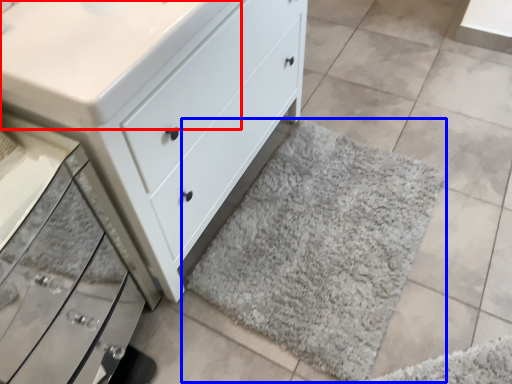
Question: Which object appears farthest to the camera in this image, counter top (highlighted by a red box) or bath mat (highlighted by a blue box)?

Choices:
 (A) counter top
 (B) bath mat

Answer: (B)